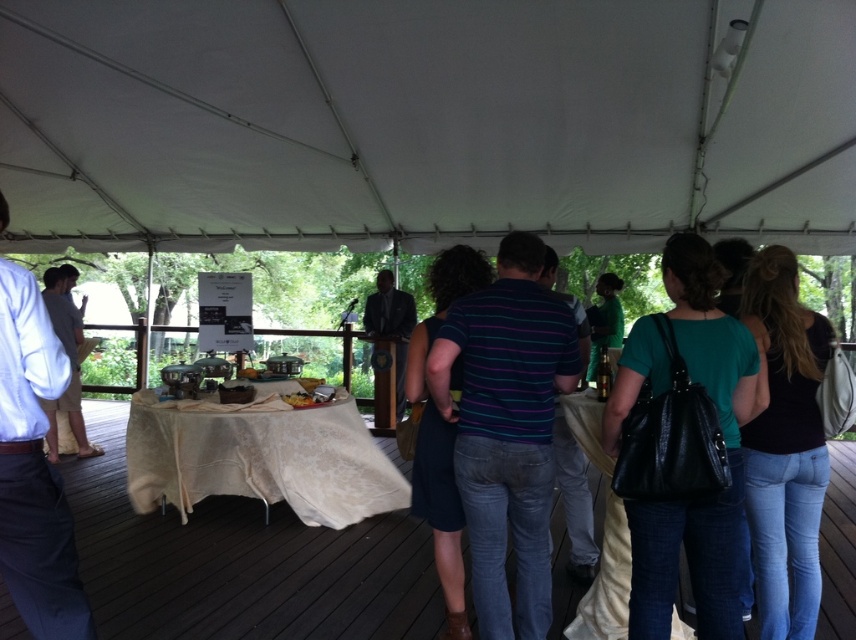
Question: Which object appears farthest from the camera in this image?

Choices:
 (A) striped cotton shirt at center
 (B) dark suit at center
 (C) light brown shorts at left

Answer: (B)

Question: Which point appears closest to the camera in this image?

Choices:
 (A) (390, 280)
 (B) (265, 397)
 (C) (48, 282)

Answer: (B)

Question: In this image, where is striped cotton shirt at center located relative to matte green shirt at center?

Choices:
 (A) below
 (B) above

Answer: (A)

Question: Which point is farther to the camera?

Choices:
 (A) white lace tablecloth at lower left
 (B) matte green shirt at center

Answer: (A)

Question: Where is white fabric-covered table at center located in relation to striped cotton shirt at center in the image?

Choices:
 (A) left
 (B) right

Answer: (A)

Question: Can you confirm if white fabric canopy at upper center is positioned to the left of striped cotton shirt at center?

Choices:
 (A) yes
 (B) no

Answer: (B)